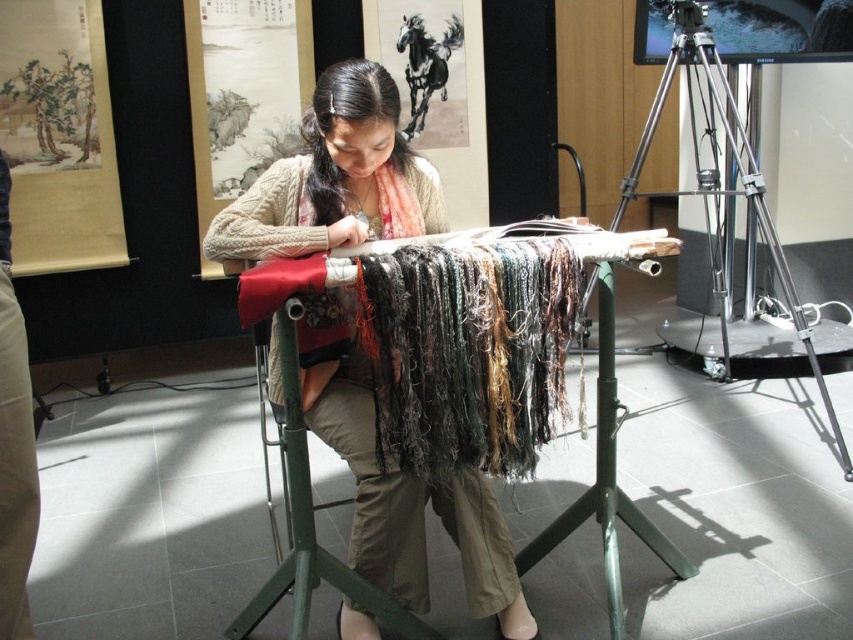
You are standing in front of the metallic green table at center and want to place a 4.5 feet long tool on it. Can you fit the tool on the table?

The distance between the metallic green table at center and the viewer is 4.46 feet, but this measurement refers to the distance from the viewer to the table, not the table size. The question about fitting a 4.5 feet long tool cannot be answered with the provided information.

You are a visitor in a workshop and want to place a heavy box on the surface. Which object between the metallic green table at center and the metallic tripod at right would be more suitable for placing the box?

The metallic green table at center is more suitable for placing the box because it is a table, which is designed to hold items, whereas the metallic tripod at right is likely meant for supporting or holding up items rather than bearing heavy loads on its surface.

You are a visitor in a workshop and see the metallic green table at center and the metallic tripod at right. Which object is closer to the floor?

The metallic green table at center is closer to the floor because it is located below the metallic tripod at right.